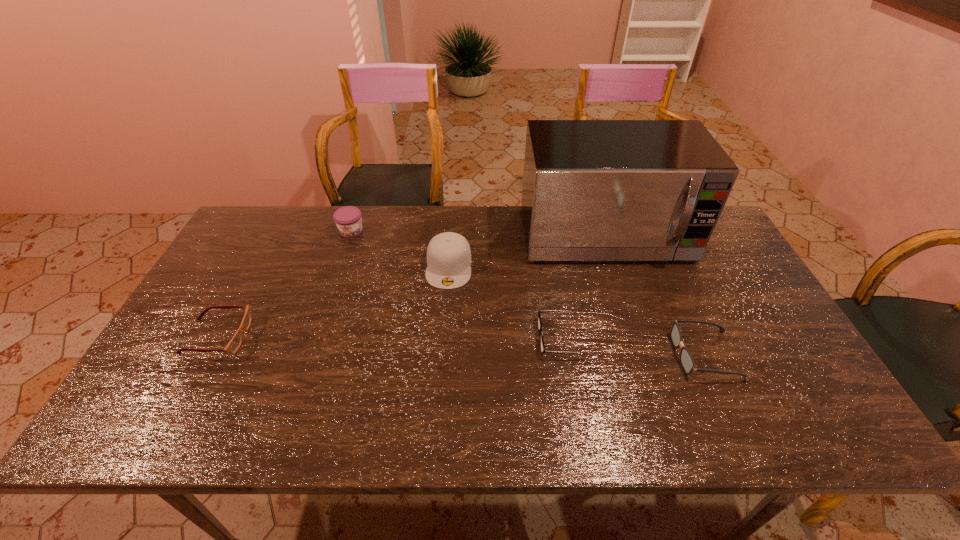
I want to click on free space located on the front-facing side of the fourth object from right to left, so click(x=439, y=406).

Image resolution: width=960 pixels, height=540 pixels. Identify the location of free space located on the front label of the third tallest object. (331, 291).

You are a GUI agent. You are given a task and a screenshot of the screen. Output one action in this format:
    pyautogui.click(x=<x>, y=<y>)
    Task: Click on the vacant area situated 0.230m on the face of the rightmost spectacles
    Image resolution: width=960 pixels, height=540 pixels.
    Given the screenshot: What is the action you would take?
    pyautogui.click(x=583, y=355)

Where is `free region located 0.160m on the face of the rightmost spectacles`? The width and height of the screenshot is (960, 540). free region located 0.160m on the face of the rightmost spectacles is located at coordinates (611, 355).

The image size is (960, 540). What are the coordinates of `free location located on the face of the rightmost spectacles` in the screenshot? It's located at (542, 355).

The height and width of the screenshot is (540, 960). I want to click on free space located 0.070m on the front-facing side of the leftmost object, so click(x=275, y=336).

The image size is (960, 540). What are the coordinates of `vacant position located on the front-facing side of the second spectacles from left to right` in the screenshot? It's located at (410, 338).

This screenshot has width=960, height=540. What are the coordinates of `vacant space located 0.200m on the front-facing side of the second spectacles from left to right` in the screenshot? It's located at (461, 338).

The width and height of the screenshot is (960, 540). In order to click on vacant space located on the front-facing side of the second spectacles from left to right in this screenshot , I will do `click(426, 338)`.

At what (x,y) coordinates should I click in order to perform the action: click on microwave oven present at the far edge. Please return your answer as a coordinate pair (x, y). Looking at the image, I should click on (593, 190).